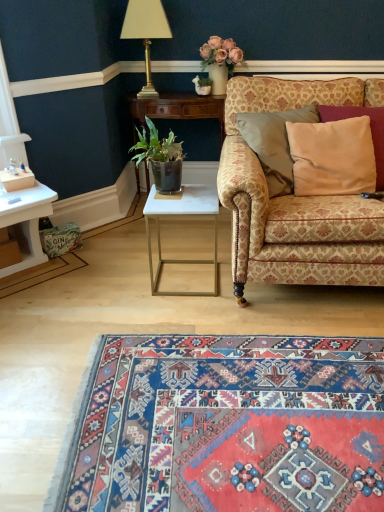
Question: Considering the positions of patterned fabric couch at right and gold metallic lamp at upper center in the image, is patterned fabric couch at right wider or thinner than gold metallic lamp at upper center?

Choices:
 (A) wide
 (B) thin

Answer: (A)

Question: Would you say patterned fabric couch at right is to the left or to the right of gold metallic lamp at upper center in the picture?

Choices:
 (A) right
 (B) left

Answer: (A)

Question: Which is nearer to the beige satin pillow at right?

Choices:
 (A) carpet with intricate patterns at lower center
 (B) white glossy side table at center, the second table from the front
 (C) gold metallic lamp at upper center
 (D) patterned fabric couch at right
 (E) white marble table at center, the first table positioned from the bottom

Answer: (D)

Question: Based on their relative distances, which object is farther from the carpet with intricate patterns at lower center?

Choices:
 (A) white marble table at center, the first table positioned from the bottom
 (B) gold metallic lamp at upper center
 (C) patterned fabric couch at right
 (D) beige satin pillow at right
 (E) white glossy side table at center, acting as the second table starting from the bottom

Answer: (B)